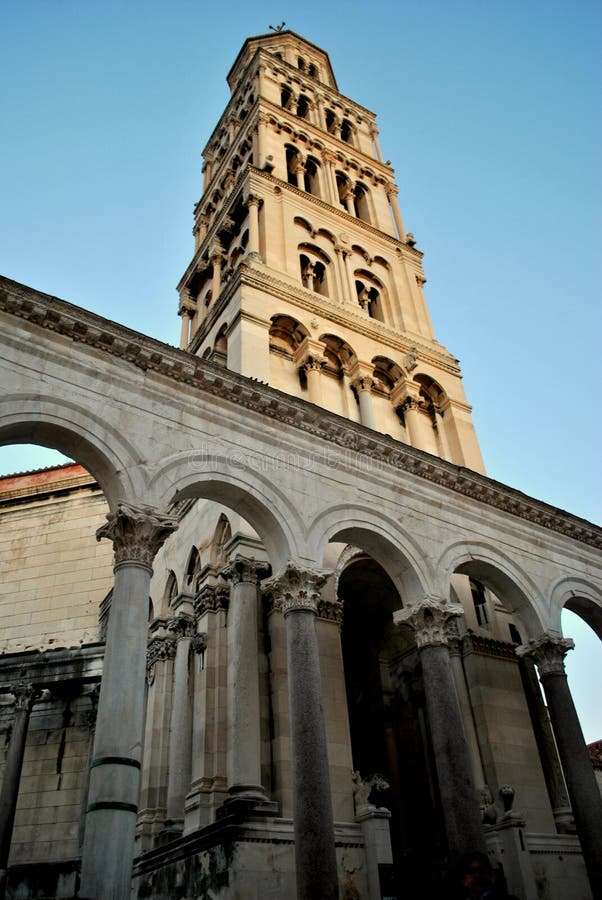
Find the location of `pillars 3rd floor`. pillars 3rd floor is located at coordinates (249, 227), (217, 274), (182, 318).